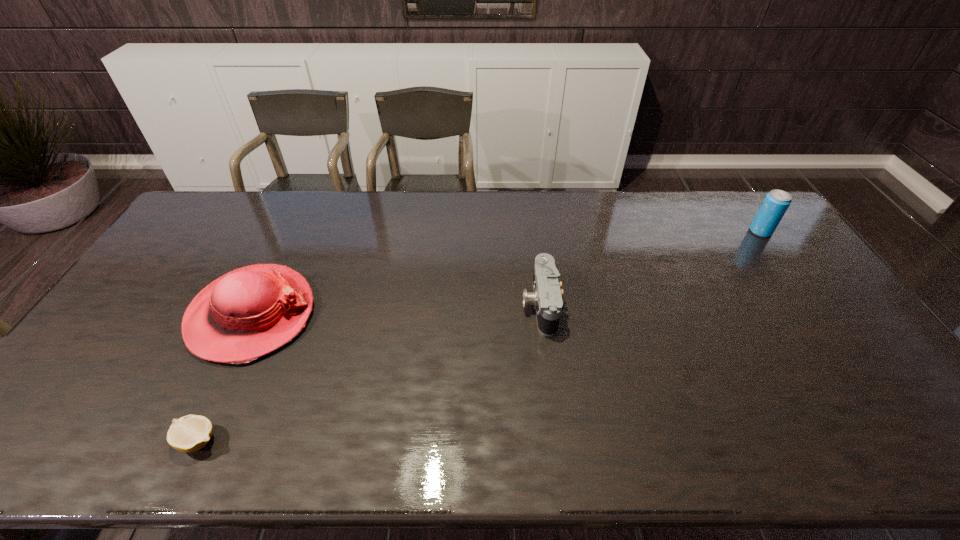
The image size is (960, 540). I want to click on free space located on the lens of the second shortest object, so click(x=454, y=305).

Locate an element on the screen. The width and height of the screenshot is (960, 540). vacant space situated 0.390m on the lens of the second shortest object is located at coordinates (390, 305).

Locate an element on the screen. The image size is (960, 540). vacant space located on the back of the nearest object is located at coordinates (264, 300).

Where is `object that is positioned at the far edge`? The height and width of the screenshot is (540, 960). object that is positioned at the far edge is located at coordinates (776, 202).

Find the location of a particular element. This screenshot has width=960, height=540. object located in the near edge section of the desktop is located at coordinates (190, 433).

This screenshot has width=960, height=540. I want to click on object that is at the right edge, so click(x=776, y=202).

Where is `object located in the far right corner section of the desktop`? Image resolution: width=960 pixels, height=540 pixels. object located in the far right corner section of the desktop is located at coordinates (776, 202).

Identify the location of vacant space at the far edge of the desktop. The image size is (960, 540). (294, 218).

Locate an element on the screen. The width and height of the screenshot is (960, 540). free region at the near edge of the desktop is located at coordinates (767, 430).

You are a GUI agent. You are given a task and a screenshot of the screen. Output one action in this format:
    pyautogui.click(x=<x>, y=<y>)
    Task: Click on the vacant space at the left edge
    
    Given the screenshot: What is the action you would take?
    pyautogui.click(x=87, y=394)